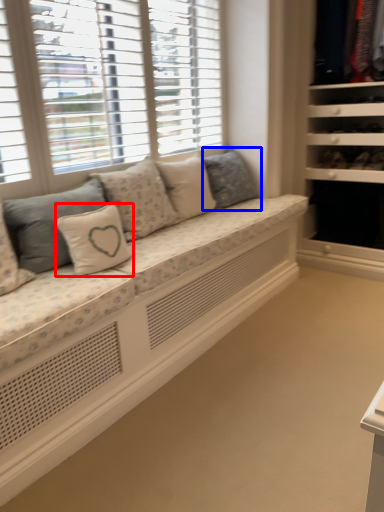
Question: Which object is closer to the camera taking this photo, pillow (highlighted by a red box) or pillow (highlighted by a blue box)?

Choices:
 (A) pillow
 (B) pillow

Answer: (A)